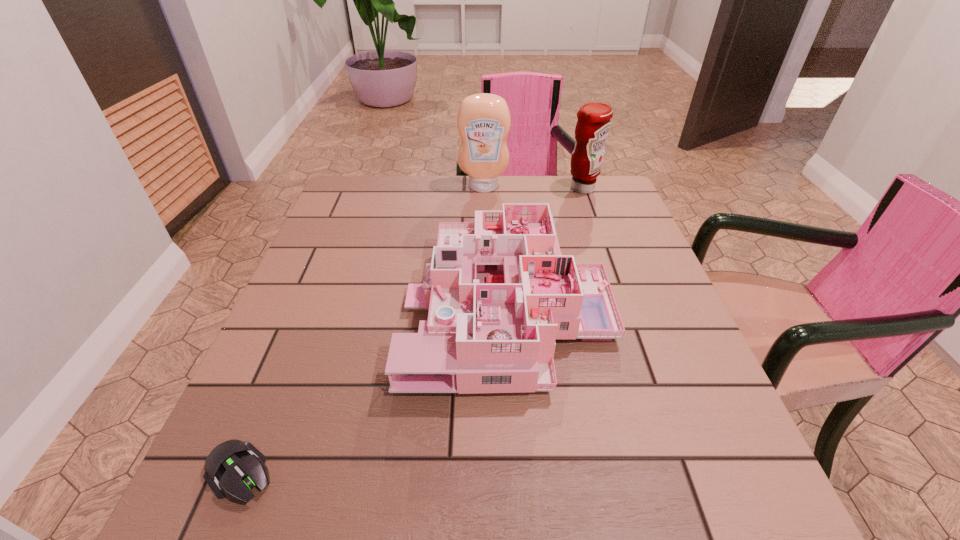
You are a GUI agent. You are given a task and a screenshot of the screen. Output one action in this format:
    pyautogui.click(x=<x>, y=<y>)
    Task: Click on the free region located at the front entrance of the second shortest object
    The height and width of the screenshot is (540, 960).
    Given the screenshot: What is the action you would take?
    pyautogui.click(x=286, y=306)

Find the location of `free space located on the right of the leftmost object`. free space located on the right of the leftmost object is located at coordinates (513, 472).

The height and width of the screenshot is (540, 960). Find the location of `object located at the near edge`. object located at the near edge is located at coordinates (233, 467).

In order to click on object that is at the left edge in this screenshot , I will do `click(233, 467)`.

Find the location of a particular element. condiment at the right edge is located at coordinates (593, 125).

Where is `dollhouse located in the right edge section of the desktop`? dollhouse located in the right edge section of the desktop is located at coordinates (499, 291).

At what (x,y) coordinates should I click in order to perform the action: click on object situated at the near left corner. Please return your answer as a coordinate pair (x, y). Looking at the image, I should click on (233, 467).

Where is `object at the far right corner`? object at the far right corner is located at coordinates (593, 125).

The width and height of the screenshot is (960, 540). In the image, there is a desktop. Identify the location of vacant space at the far edge. (426, 199).

In the image, there is a desktop. Where is `vacant space at the near edge`? vacant space at the near edge is located at coordinates (648, 480).